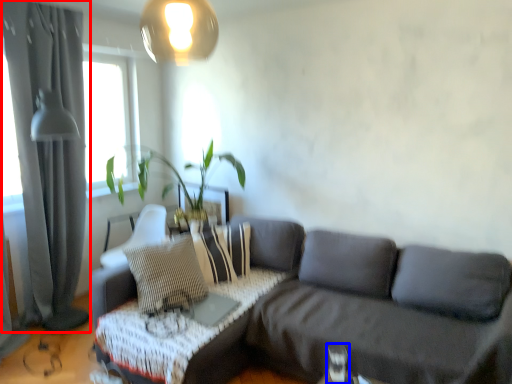
Question: Which of the following is the closest to the observer, curtain (highlighted by a red box) or table lamp (highlighted by a blue box)?

Choices:
 (A) curtain
 (B) table lamp

Answer: (B)